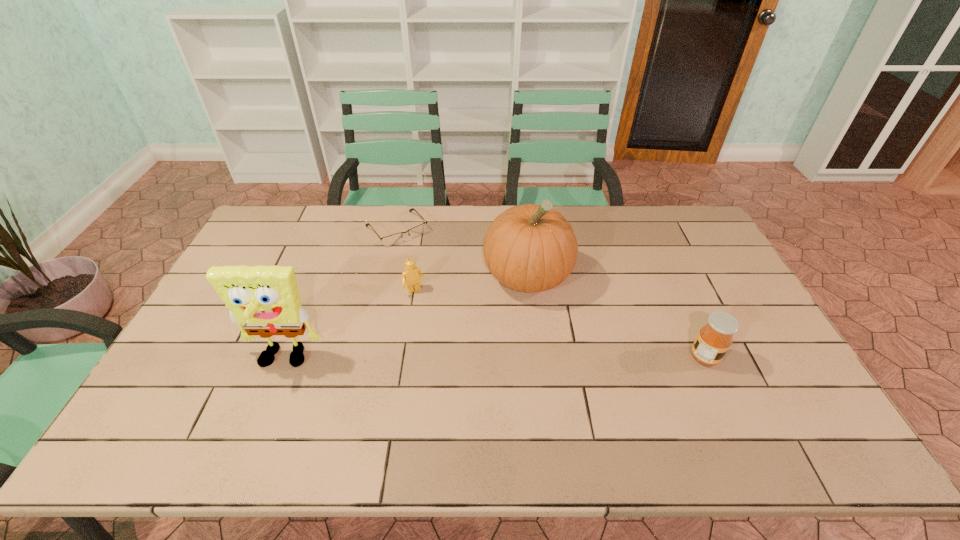
Find the location of `free space on the desktop that is between the sponge and the honey and is positioned on the stem of the pumpkin`. free space on the desktop that is between the sponge and the honey and is positioned on the stem of the pumpkin is located at coordinates (540, 359).

Where is `vacant spot on the desktop that is between the sponge and the rightmost object and is positioned on the front-facing side of the shortest object`? The width and height of the screenshot is (960, 540). vacant spot on the desktop that is between the sponge and the rightmost object and is positioned on the front-facing side of the shortest object is located at coordinates (506, 359).

This screenshot has height=540, width=960. Identify the location of free space on the desktop that is between the sponge and the rightmost object and is positioned on the face of the Lego. (454, 359).